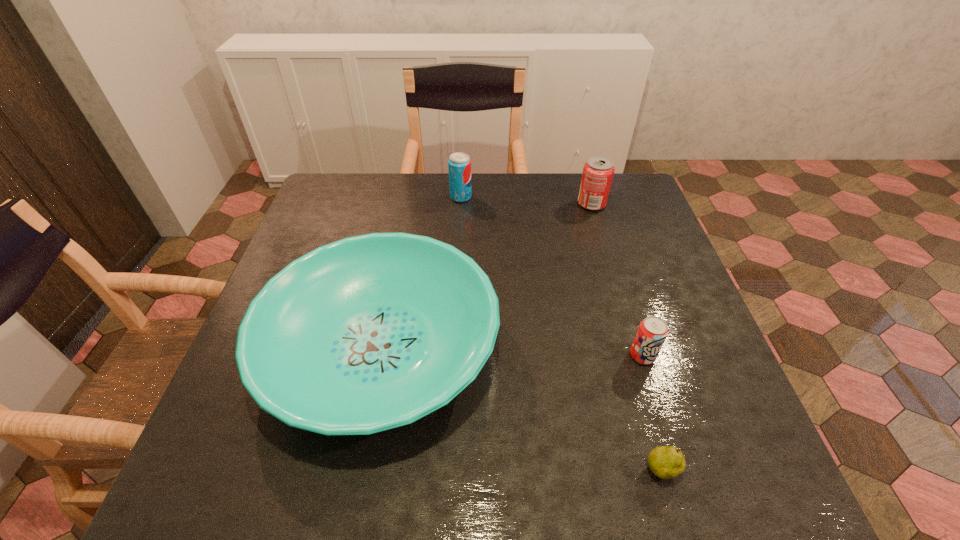
Where is `object at the left edge`? The height and width of the screenshot is (540, 960). object at the left edge is located at coordinates (368, 333).

Locate an element on the screen. pear present at the right edge is located at coordinates (666, 462).

Find the location of a particular element. object that is at the near left corner is located at coordinates (368, 333).

Where is `object present at the far right corner`? This screenshot has width=960, height=540. object present at the far right corner is located at coordinates (598, 171).

Image resolution: width=960 pixels, height=540 pixels. I want to click on object present at the near right corner, so click(666, 462).

This screenshot has width=960, height=540. Identify the location of vacant area at the far edge of the desktop. (488, 210).

Locate an element on the screen. Image resolution: width=960 pixels, height=540 pixels. vacant space at the near edge of the desktop is located at coordinates (526, 497).

Locate an element on the screen. The width and height of the screenshot is (960, 540). free space at the far left corner of the desktop is located at coordinates pos(361,192).

Locate an element on the screen. Image resolution: width=960 pixels, height=540 pixels. free region at the far right corner of the desktop is located at coordinates (626, 205).

Find the location of `vacant space at the near right corner of the desktop`. vacant space at the near right corner of the desktop is located at coordinates point(721,464).